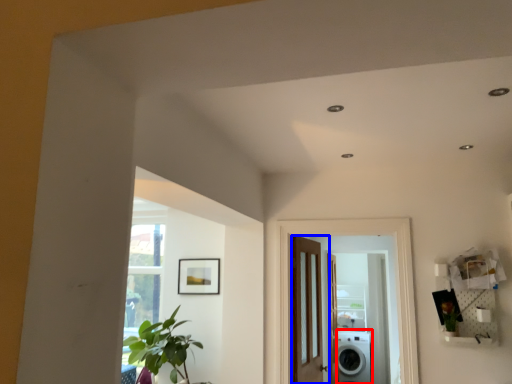
Question: Which of the following is the closest to the observer, washing machine (highlighted by a red box) or door (highlighted by a blue box)?

Choices:
 (A) washing machine
 (B) door

Answer: (B)